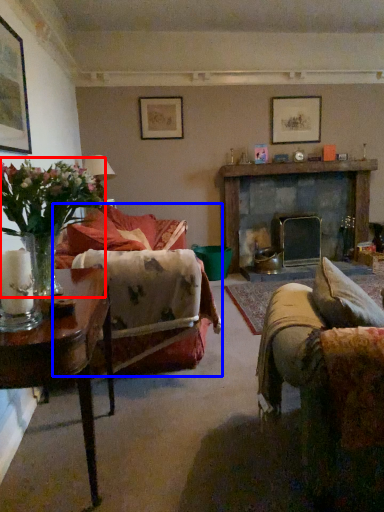
Question: Which point is closer to the camera, houseplant (highlighted by a red box) or studio couch (highlighted by a blue box)?

Choices:
 (A) houseplant
 (B) studio couch

Answer: (A)